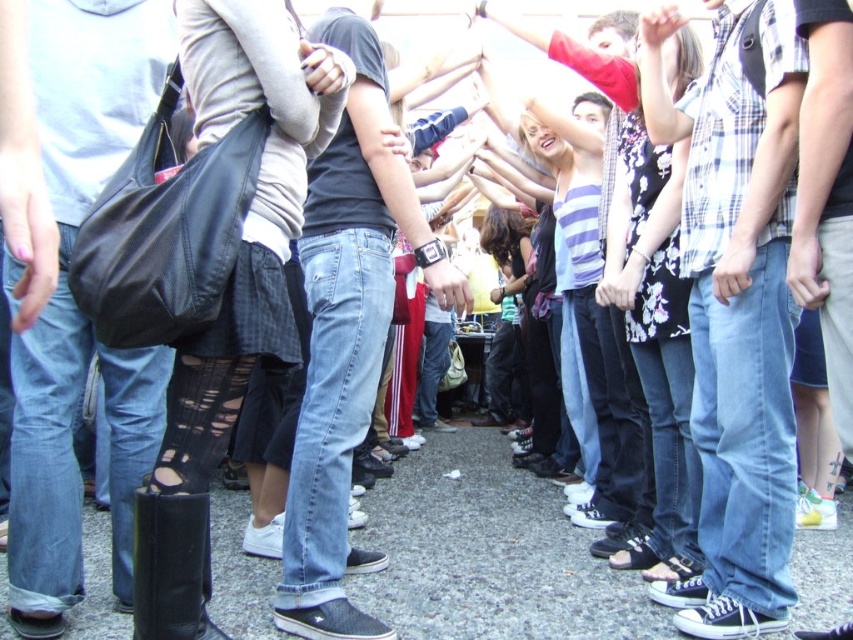
You are a photographer trying to capture a closeup of the plaid cotton shirt at center and the jeans at center. Based on their positions, which one should you focus on first if you want to ensure both are in focus?

Since the plaid cotton shirt at center is below jeans at center, you should focus on the jeans at center first as it is closer to the camera, ensuring both will be in focus when using depth of field.

You are a photographer standing at the center of the scene. You notice a point at coordinates (x=735, y=310). What object is located at that point?

The point at coordinates (x=735, y=310) marks the plaid cotton shirt at center.